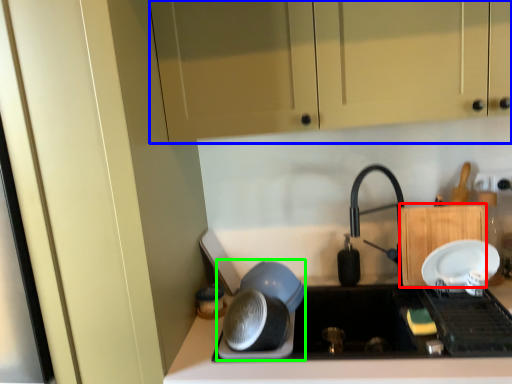
Question: Which object is positioned farthest from cabinetry (highlighted by a red box)? Select from cabinetry (highlighted by a blue box) and appliance (highlighted by a green box).

Choices:
 (A) cabinetry
 (B) appliance

Answer: (A)